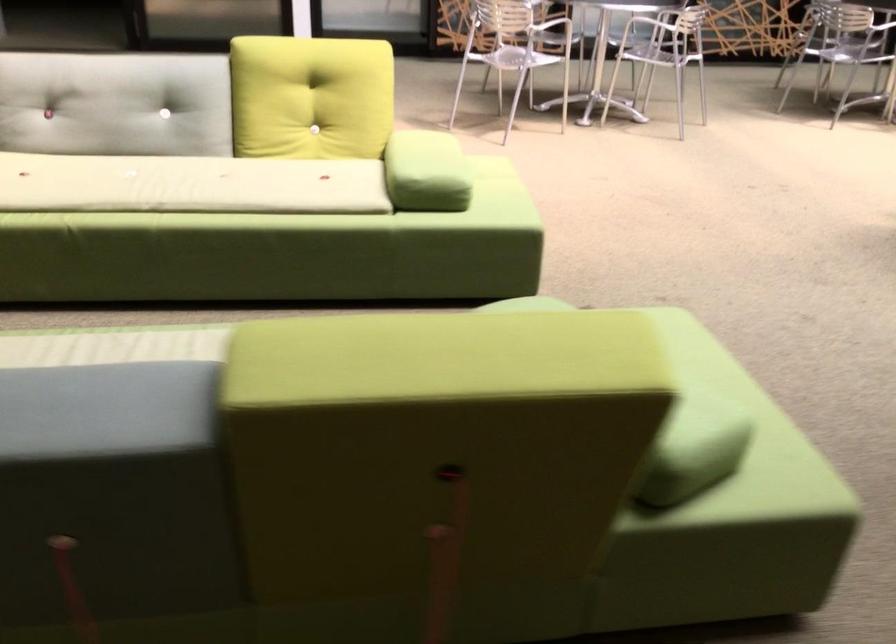
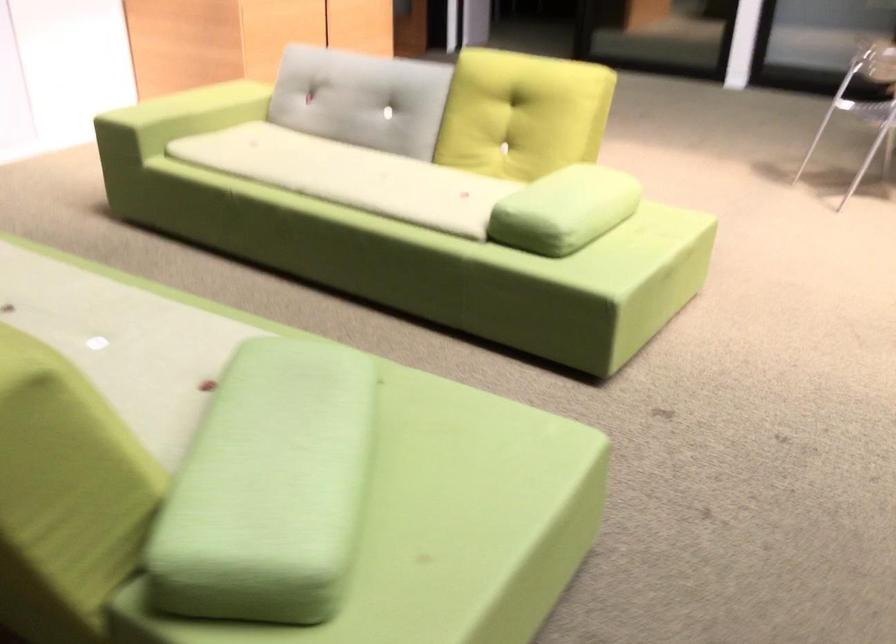
Find the pixel in the second image that matches point 161,350 in the first image.

(66, 290)